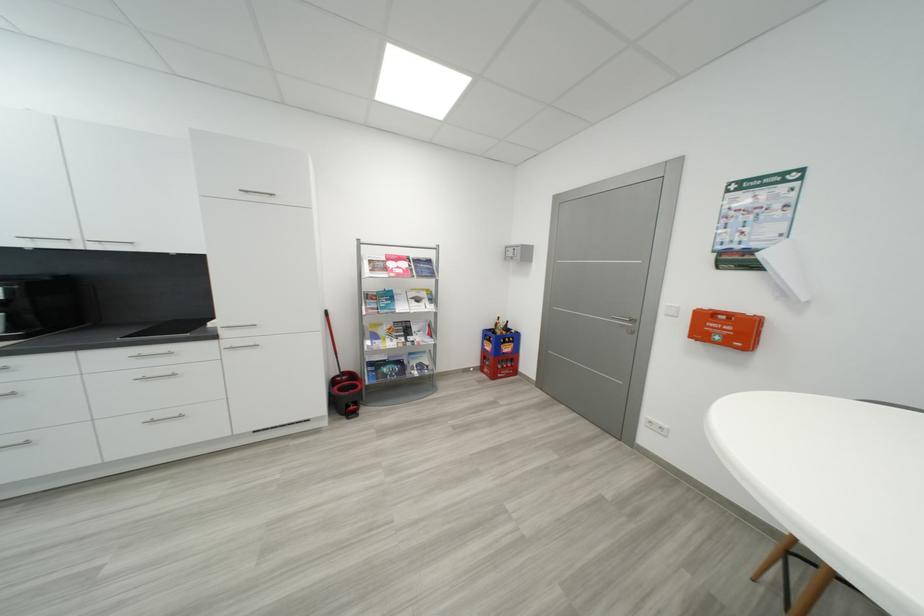
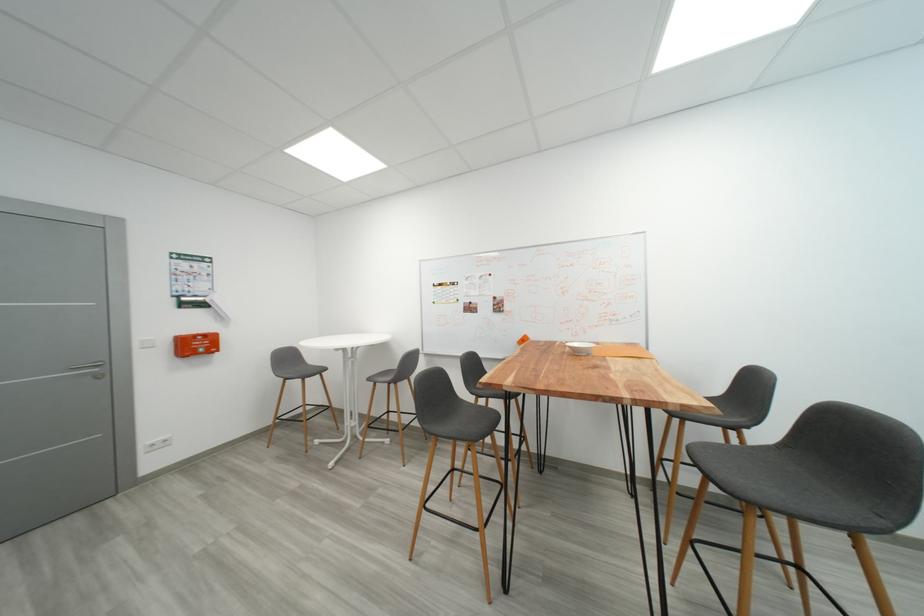
Locate, in the second image, the point that corresponds to (733,333) in the first image.

(203, 347)